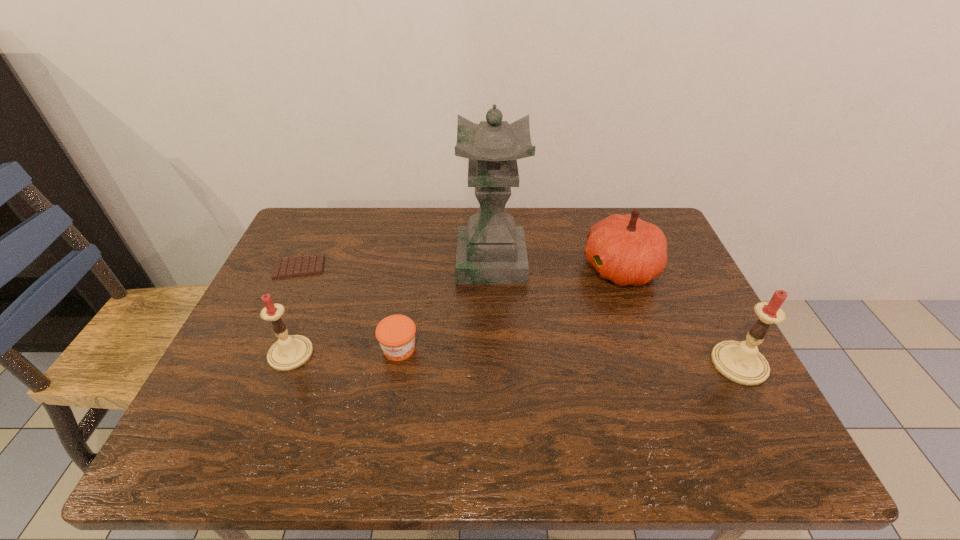
This screenshot has height=540, width=960. In order to click on the shorter candle in this screenshot , I will do `click(290, 351)`.

Identify the location of the rightmost object. (741, 362).

Identify the location of the right candle. (741, 362).

What are the coordinates of `chocolate bar` in the screenshot? It's located at (306, 265).

Locate an element on the screen. The width and height of the screenshot is (960, 540). the tallest object is located at coordinates (490, 250).

You are a GUI agent. You are given a task and a screenshot of the screen. Output one action in this format:
    pyautogui.click(x=<x>, y=<y>)
    Task: Click on the sculpture
    The height and width of the screenshot is (540, 960).
    Given the screenshot: What is the action you would take?
    pyautogui.click(x=490, y=250)

This screenshot has height=540, width=960. What are the coordinates of `pumpkin` in the screenshot? It's located at (624, 249).

In order to click on the third object from left to right in this screenshot , I will do `click(396, 334)`.

This screenshot has height=540, width=960. In order to click on jam in this screenshot , I will do `click(396, 334)`.

Identify the location of free space located on the back of the left candle. (314, 296).